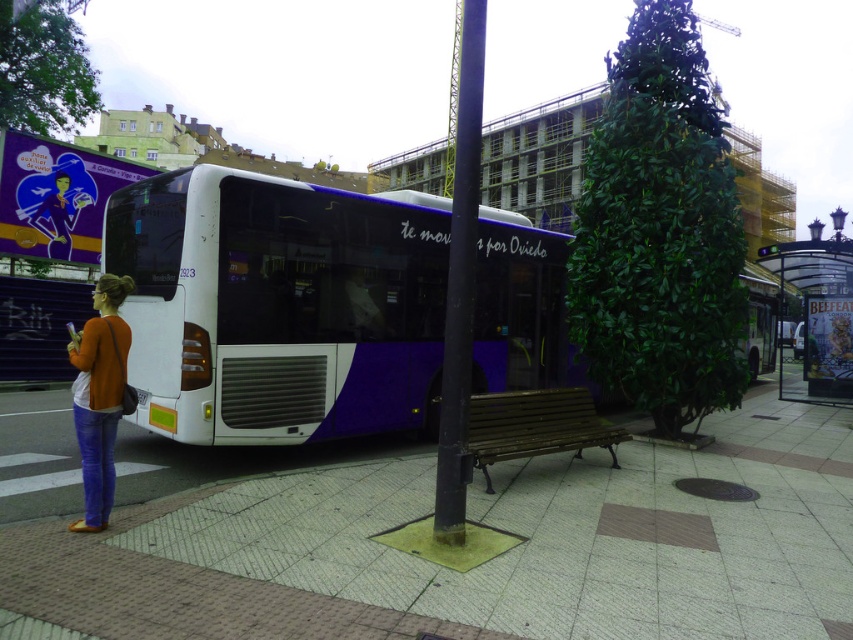
You are a city planner assessing the bus stop layout. The smooth concrete bench at center and the white matte bus at center are both at the center. Which object has a smaller width?

The smooth concrete bench at center has a smaller width than the white matte bus at center according to the description.

You are standing at the bus stop and want to sit down. The bus is white with purple accents and has the text te mov por Oviedo and number 2023. There is a point at coordinates (440,564). Is this point on the bench where you can sit?

The point at coordinates (440,564) corresponds to the smooth concrete bench at center, so yes, you can sit there.